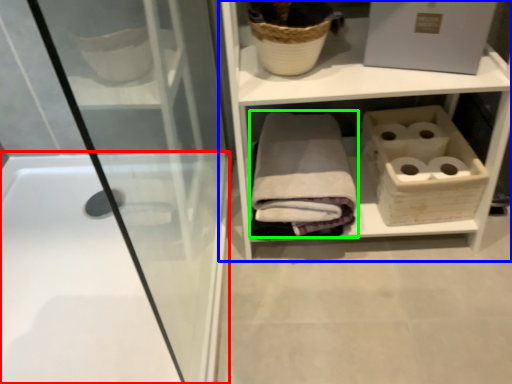
Question: Which object is the farthest from bathtub (highlighted by a red box)? Choose among these: shelf (highlighted by a blue box) or bath towel (highlighted by a green box).

Choices:
 (A) shelf
 (B) bath towel

Answer: (A)